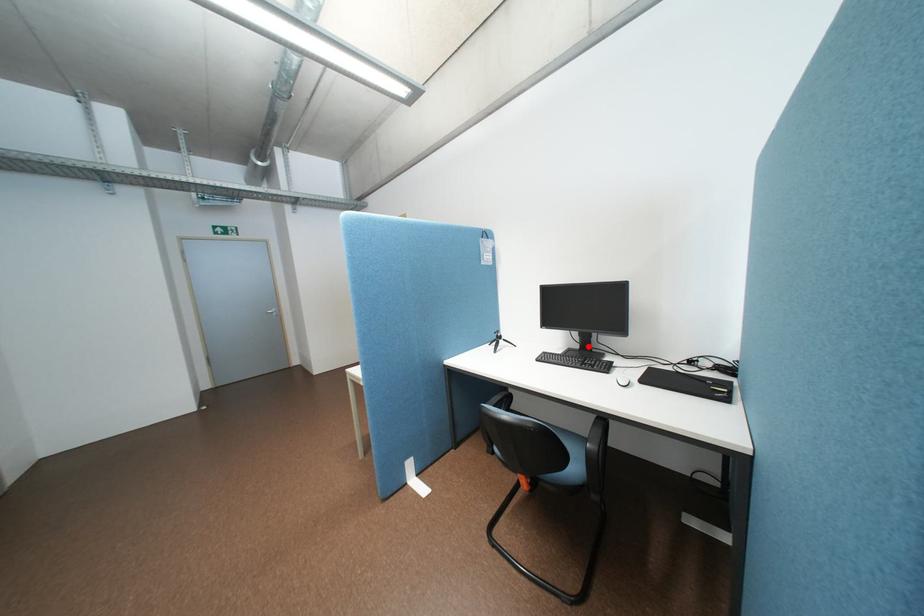
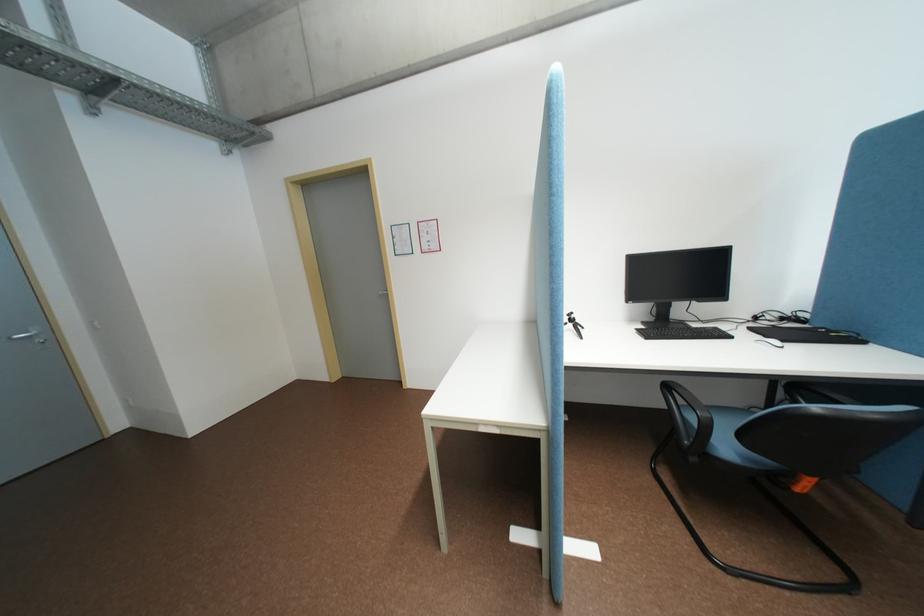
Question: I am providing you with two images of the same scene from different viewpoints. Given a red point in image1, look at the same physical point in image2. Is it:

Choices:
 (A) Closer to the viewpoint
 (B) Farther from the viewpoint

Answer: (A)